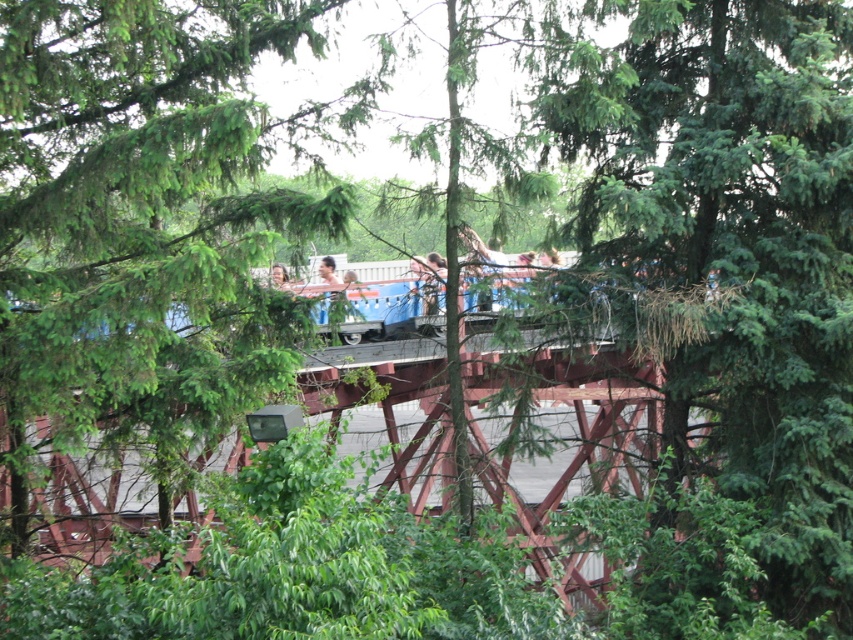
Is point (215, 198) closer to camera compared to point (430, 456)?

Yes, point (215, 198) is in front of point (430, 456).

This screenshot has height=640, width=853. I want to click on green leafy tree at upper center, so click(138, 227).

What do you see at coordinates (728, 252) in the screenshot? This screenshot has height=640, width=853. I see `green leafy tree at center` at bounding box center [728, 252].

Is green leafy tree at center below metallic red bridge at center?

Incorrect, green leafy tree at center is not positioned below metallic red bridge at center.

Between point (680, 252) and point (573, 444), which one is positioned behind?

Positioned behind is point (680, 252).

This screenshot has height=640, width=853. Find the location of `green leafy tree at center`. green leafy tree at center is located at coordinates (728, 252).

Consider the image. Who is positioned more to the right, metallic red bridge at center or smooth skin face at center?

metallic red bridge at center is more to the right.

The height and width of the screenshot is (640, 853). What do you see at coordinates (567, 440) in the screenshot?
I see `metallic red bridge at center` at bounding box center [567, 440].

Who is more distant from viewer, (566, 385) or (287, 275)?

The point (566, 385) is more distant.

Locate an element on the screen. The height and width of the screenshot is (640, 853). metallic red bridge at center is located at coordinates (567, 440).